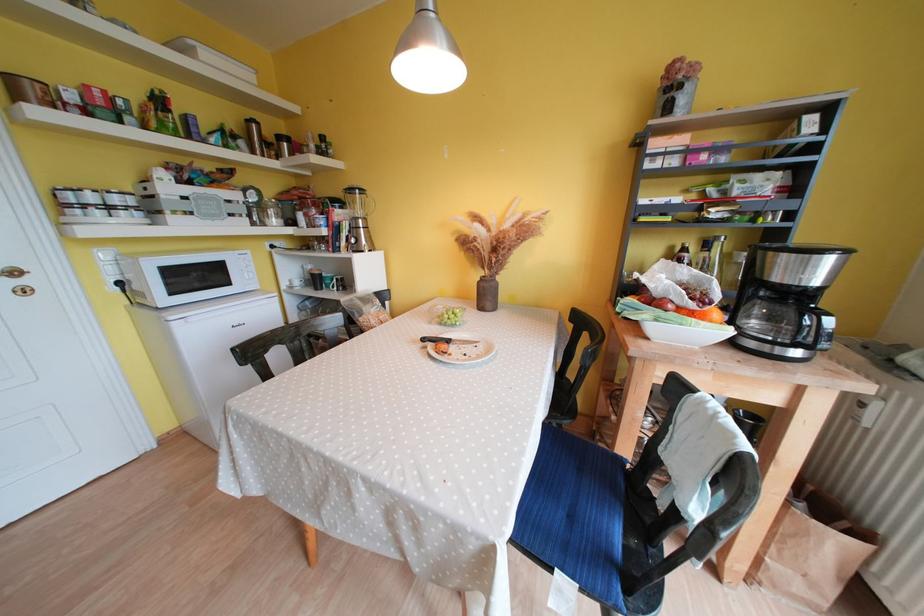
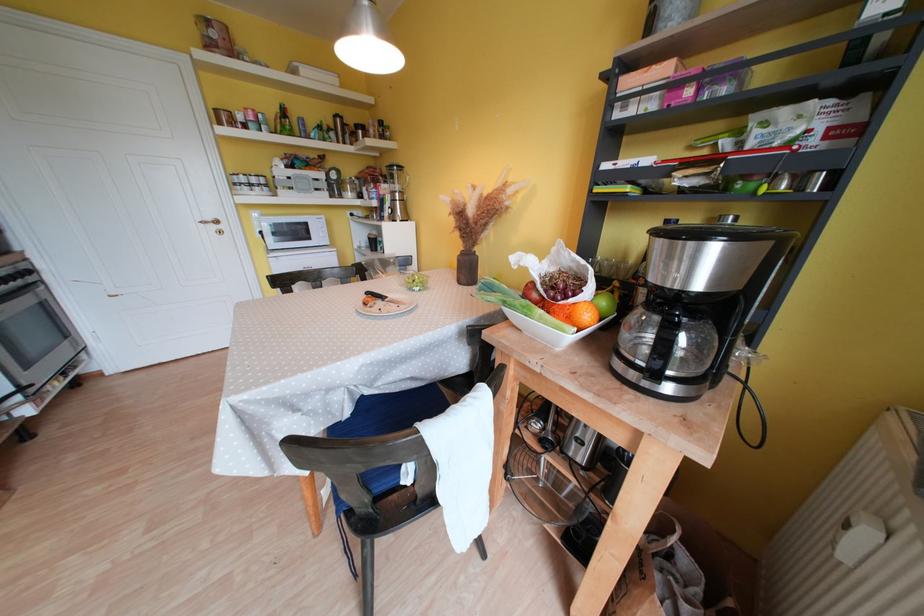
In the second image, find the point that corresponds to point (492, 301) in the first image.

(472, 275)